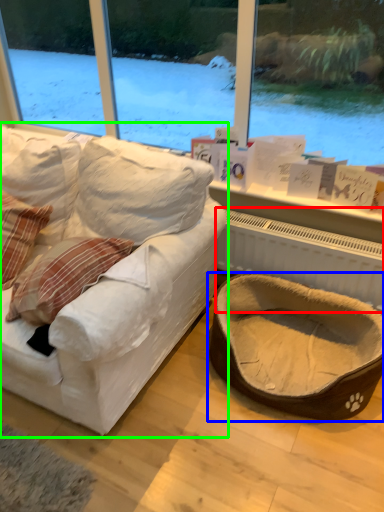
Question: Considering the real-world distances, which object is farthest from radiator (highlighted by a red box)? dog bed (highlighted by a blue box) or studio couch (highlighted by a green box)?

Choices:
 (A) dog bed
 (B) studio couch

Answer: (B)